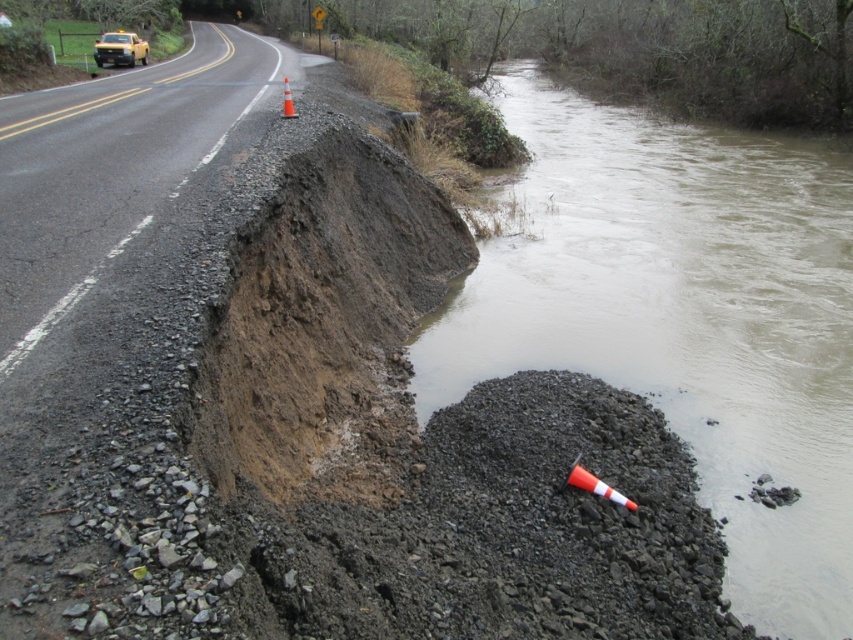
Looking at this image, does muddy gravel river at lower right appear under orange reflective cone at road center?

Yes.

Between muddy gravel river at lower right and orange reflective cone at road center, which one appears on the left side from the viewer's perspective?

orange reflective cone at road center

Image resolution: width=853 pixels, height=640 pixels. Describe the element at coordinates (683, 317) in the screenshot. I see `muddy gravel river at lower right` at that location.

What are the coordinates of `muddy gravel river at lower right` in the screenshot? It's located at (683, 317).

At what (x,y) coordinates should I click in order to perform the action: click on brown dirt at center. Please return your answer as a coordinate pair (x, y). Image resolution: width=853 pixels, height=640 pixels. Looking at the image, I should click on (323, 324).

Is brown dirt at center shorter than orange reflective cone at lower right?

In fact, brown dirt at center may be taller than orange reflective cone at lower right.

Between point (363, 448) and point (585, 480), which one is positioned in front?

Point (585, 480) is in front.

Image resolution: width=853 pixels, height=640 pixels. What are the coordinates of `brown dirt at center` in the screenshot? It's located at (323, 324).

Is brown dirt at center further to the viewer compared to yellow plastic car at upper left?

No, brown dirt at center is in front of yellow plastic car at upper left.

Which is above, brown dirt at center or yellow plastic car at upper left?

yellow plastic car at upper left is above.

Where is `brown dirt at center`? This screenshot has height=640, width=853. brown dirt at center is located at coordinates (323, 324).